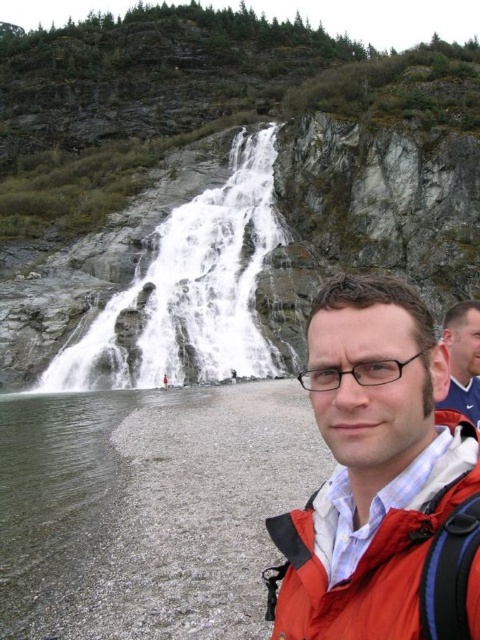
You are a hiker trying to decide whether to cross a stream in the scene. You see the matte orange jacket at lower right and the white textured water at upper center. Which object is narrower, and would that help you decide the safest path?

The matte orange jacket at lower right is thinner than the white textured water at upper center. Since the matte orange jacket at lower right is narrower, it might indicate a safer path with less water flow, but you should still assess the actual stream conditions before crossing.

You are a photographer trying to capture the waterfall in the background. You notice the matte orange jacket at lower right and the matte black glasses at center. Which object is blocking your view of the waterfall more?

The matte orange jacket at lower right is closer to the viewer than the matte black glasses at center, so it is blocking the view of the waterfall more.

You are a photographer standing at the point labeled as point (191, 291) in the image. You want to capture a photo of the white textured water at upper center. Based on your position, can you see the white textured water at upper center clearly?

Yes, since the point 0.458, 0.398 is labeled as indicating the white textured water at upper center, you are positioned directly at that point and can clearly see it.